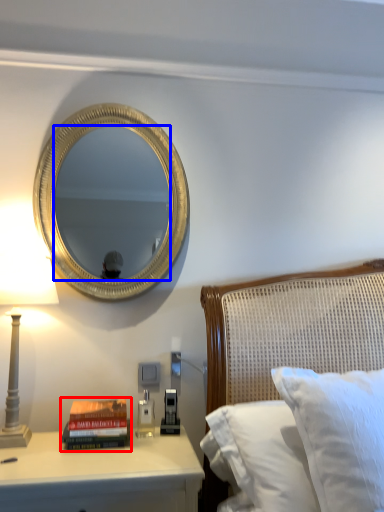
Question: Which object appears farthest to the camera in this image, paperback book (highlighted by a red box) or mirror (highlighted by a blue box)?

Choices:
 (A) paperback book
 (B) mirror

Answer: (B)